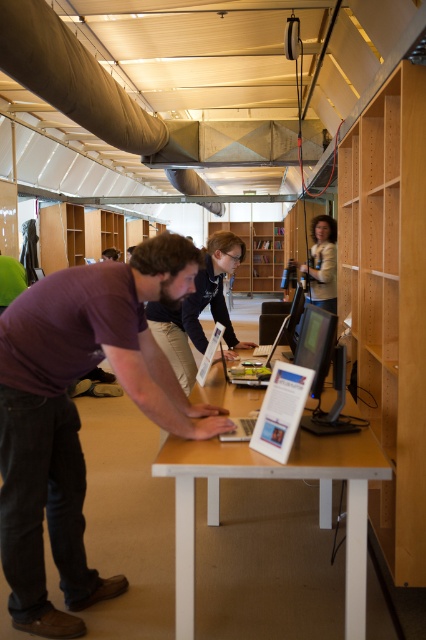
You are a visitor in the library and want to place a heavy book on the wooden table at center. However, you notice the wooden bookshelf at center above it. Is there enough vertical space between them for you to place the book without it touching the bookshelf?

The wooden table at center is below the wooden bookshelf at center, so there is vertical space between them. However, the exact height isn t specified, so it s uncertain if it s enough to place the book without touching the shelf. Check the available space before placing the book.

You are a photographer trying to capture a group of people at the library table. The purple cotton shirt at center and the matte black camera at upper center are both in your frame. Which object should you focus on if you want to capture the larger one?

The purple cotton shirt at center is bigger than the matte black camera at upper center, so you should focus on the purple cotton shirt at center to capture the larger one.

You are a visitor in the library and want to take a photo of the purple cotton shirt at center without including the light wood bookshelf at right in the background. Is this possible based on their positions?

The purple cotton shirt at center is in front of the light wood bookshelf at right, so yes, you can take a photo of the purple cotton shirt at center without including the light wood bookshelf at right in the background by positioning yourself so the shirt blocks the bookshelf from view.